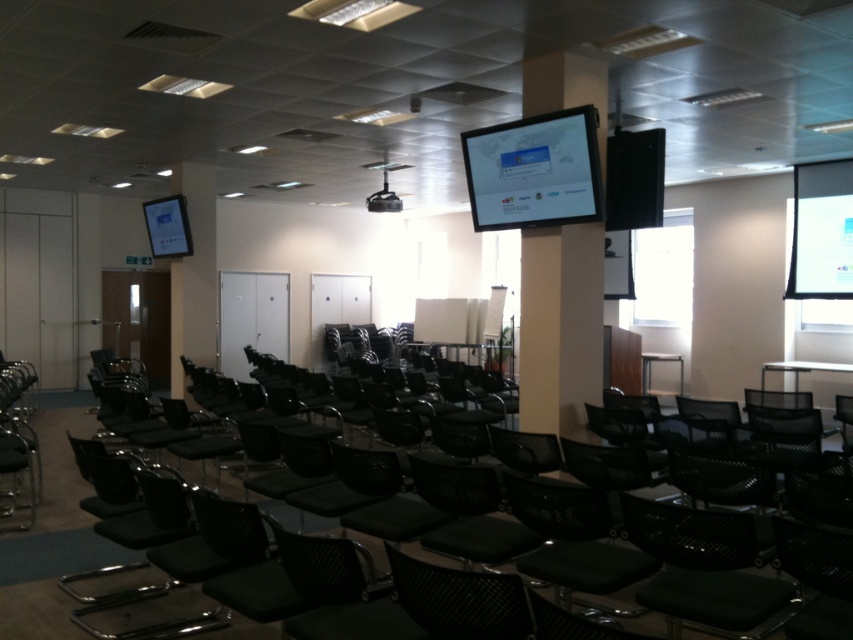
You are an event organizer setting up the conference room. You need to place a new decorative item between the smooth white pillar at center and the matte black tablet at upper left. Based on their positions, which object should the decorative item be closer to?

The decorative item should be closer to the matte black tablet at upper left because the smooth white pillar at center is in front of it, meaning the tablet is further back. Placing the item between them would require positioning it nearer to the tablet to maintain spatial balance.

You are standing at the entrance of the conference room and want to locate the white matte projection screen at upper right. According to the coordinates given, where should you look?

The white matte projection screen at upper right is located at point 0.362 on the x axis and 0.964 on the y axis.

You are an event organizer setting up for a presentation. You need to place a new speaker system between the smooth white pillar at center and the matte black tablet at upper left. According to the room layout, where should you position the speaker system so it is between these two objects?

The speaker system should be placed between the smooth white pillar at center and the matte black tablet at upper left. Since the smooth white pillar at center is to the right of the matte black tablet at upper left, the speaker system should be positioned to the right of the matte black tablet at upper left but to the left of the smooth white pillar at center.